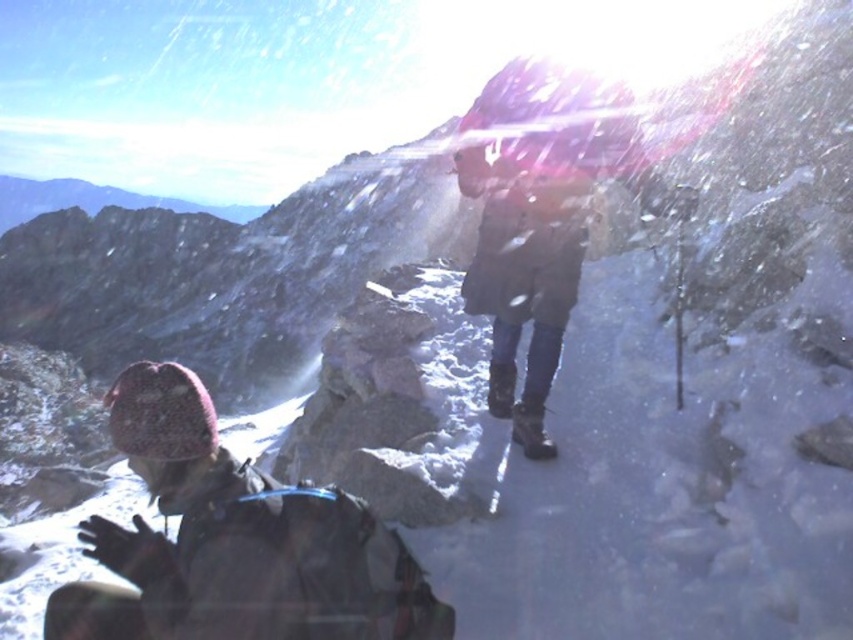
Between dark gray wool hat at lower left and brown leather jacket at center, which one has more height?

With more height is brown leather jacket at center.

Can you confirm if dark gray wool hat at lower left is wider than brown leather jacket at center?

Correct, the width of dark gray wool hat at lower left exceeds that of brown leather jacket at center.

The image size is (853, 640). What do you see at coordinates (234, 541) in the screenshot?
I see `dark gray wool hat at lower left` at bounding box center [234, 541].

This screenshot has height=640, width=853. I want to click on dark gray wool hat at lower left, so click(x=234, y=541).